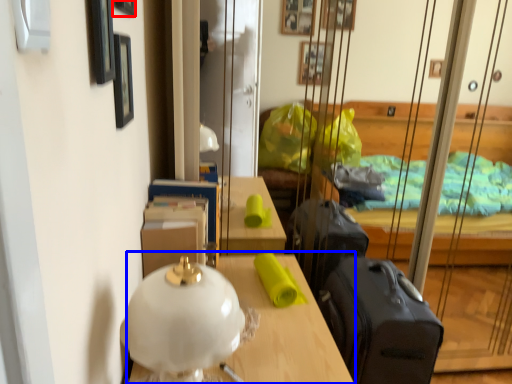
Question: Which of the following is the closest to the observer, picture frame (highlighted by a red box) or table (highlighted by a blue box)?

Choices:
 (A) picture frame
 (B) table

Answer: (A)